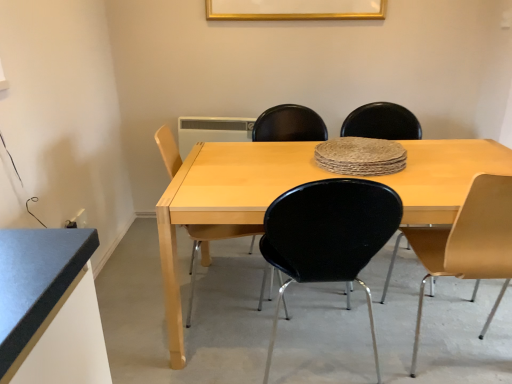
Where is `vacant space to the left of glossy black chair at center, which is the 2th chair from left to right`? The width and height of the screenshot is (512, 384). vacant space to the left of glossy black chair at center, which is the 2th chair from left to right is located at coordinates (215, 356).